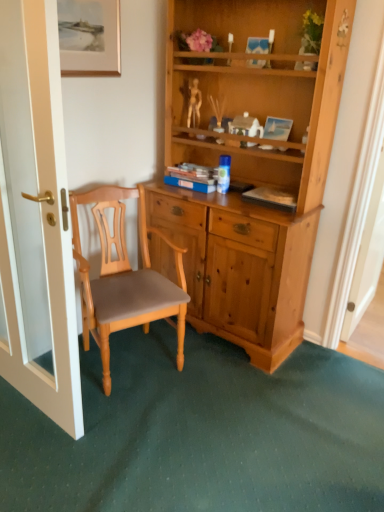
Locate an element on the screen. This screenshot has width=384, height=512. vacant space to the right of white glossy door at left is located at coordinates (141, 431).